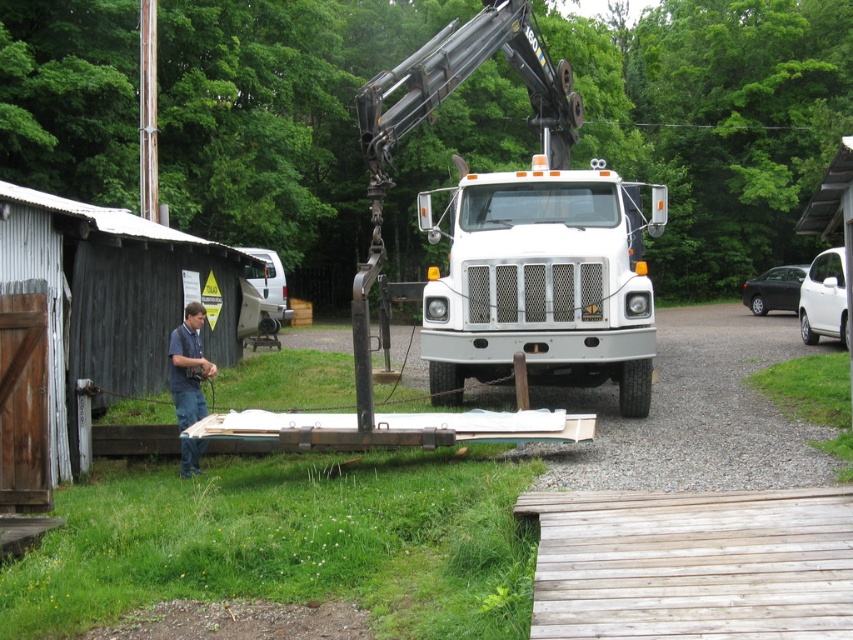
Question: Among these points, which one is nearest to the camera?

Choices:
 (A) (529, 227)
 (B) (199, 381)

Answer: (B)

Question: Is white matte truck at center to the left of blue jeans at left from the viewer's perspective?

Choices:
 (A) yes
 (B) no

Answer: (B)

Question: Is white matte truck at center further to camera compared to blue jeans at left?

Choices:
 (A) yes
 (B) no

Answer: (A)

Question: Which of the following is the farthest from the observer?

Choices:
 (A) white matte truck at center
 (B) blue jeans at left

Answer: (A)

Question: Is white matte truck at center wider than blue jeans at left?

Choices:
 (A) yes
 (B) no

Answer: (A)